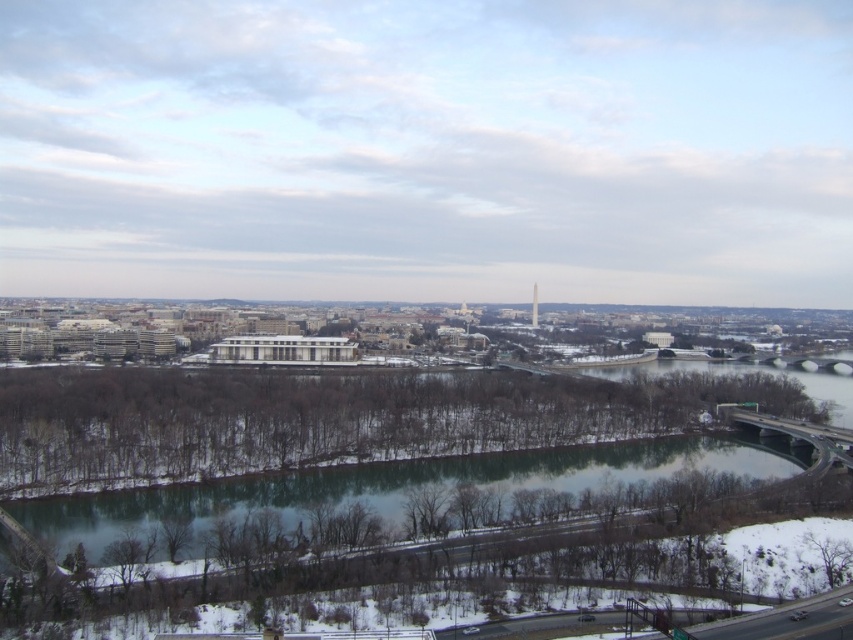
In the scene shown: Who is positioned more to the left, snowy white river at center or greenish-blue water at center?

snowy white river at center is more to the left.

Does snowy white river at center appear under greenish-blue water at center?

No.

Is point (451, 564) behind point (64, 522)?

No.

At what (x,y) coordinates should I click in order to perform the action: click on snowy white river at center. Please return your answer as a coordinate pair (x, y). The width and height of the screenshot is (853, 640). Looking at the image, I should click on click(393, 486).

The width and height of the screenshot is (853, 640). Identify the location of snowy white river at center. (393, 486).

Who is shorter, snowy white river at center or metallic gold tower at center?

snowy white river at center

Who is more forward, (252, 371) or (537, 314)?

Point (252, 371) is in front.

At what (x,y) coordinates should I click in order to perform the action: click on snowy white river at center. Please return your answer as a coordinate pair (x, y). The width and height of the screenshot is (853, 640). Looking at the image, I should click on (393, 486).

Who is shorter, greenish-blue water at center or metallic gold tower at center?

greenish-blue water at center

Is greenish-blue water at center below metallic gold tower at center?

Correct, greenish-blue water at center is located below metallic gold tower at center.

Does point (67, 502) lie behind point (534, 323)?

That is False.

I want to click on greenish-blue water at center, so click(x=390, y=488).